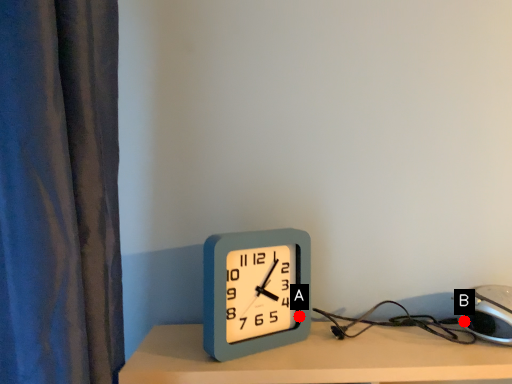
Question: Two points are circled on the image, labeled by A and B beside each circle. Which point appears closest to the camera in this image?

Choices:
 (A) A is closer
 (B) B is closer

Answer: (B)